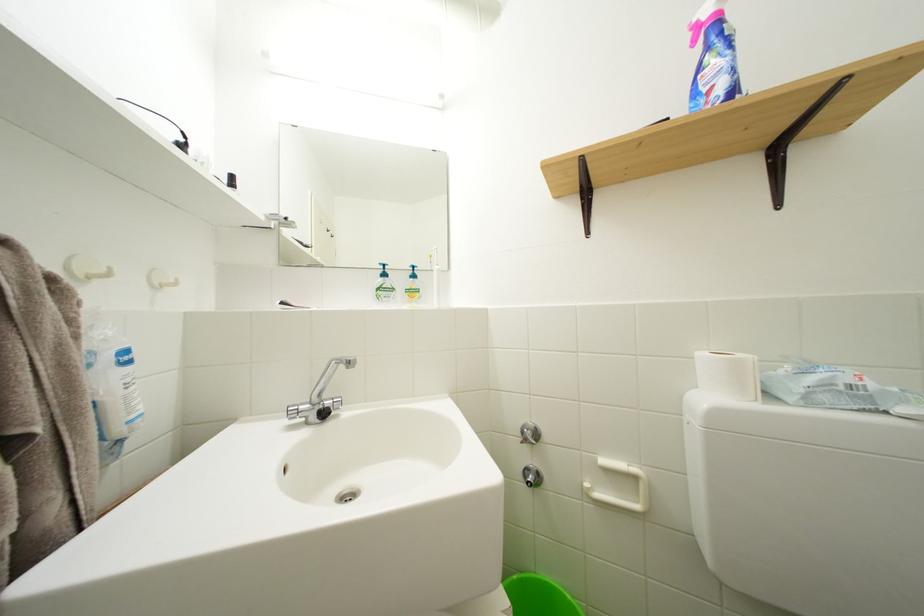
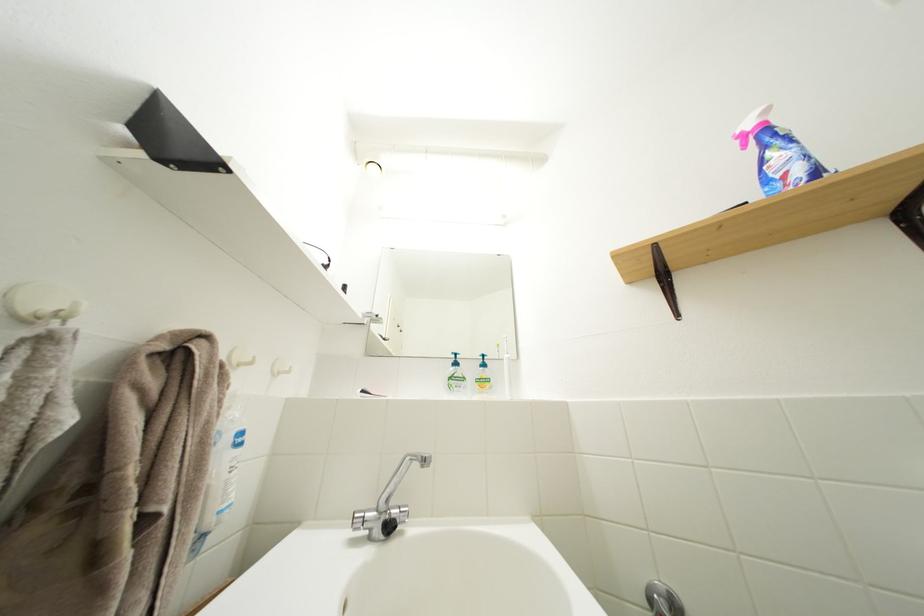
The point at (x=699, y=39) is marked in the first image. Where is the corresponding point in the second image?

(746, 148)